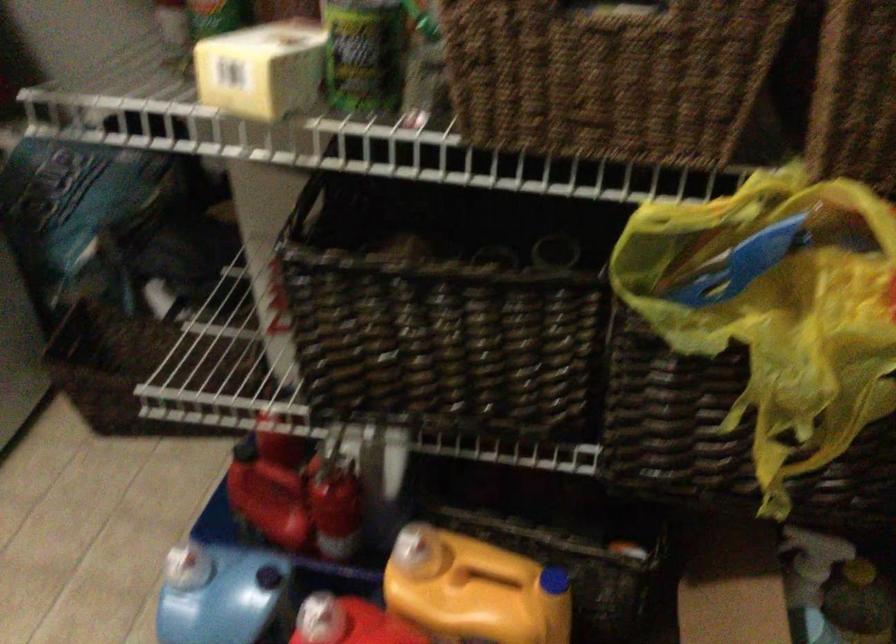
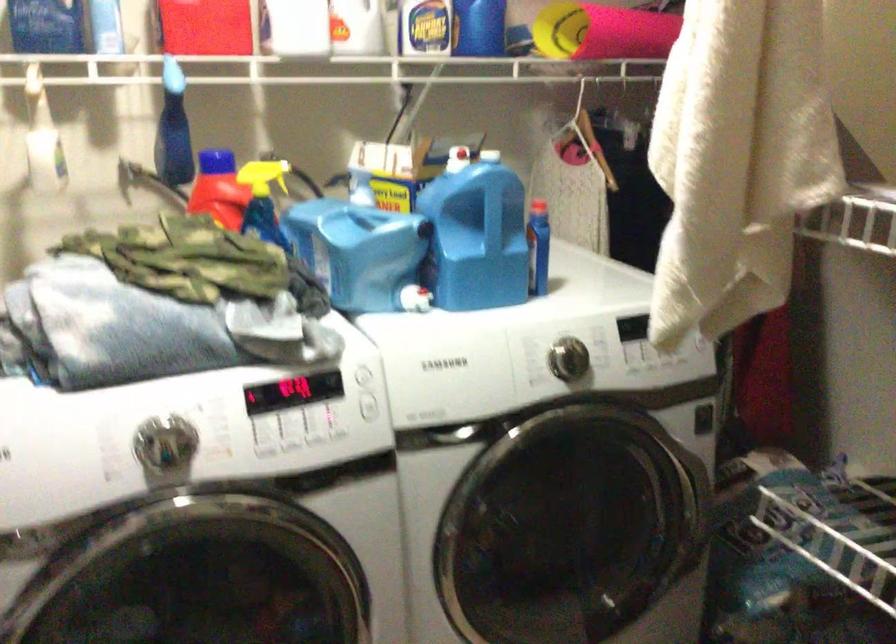
Question: The images are taken continuously from a first-person perspective. In which direction is your viewpoint rotating?

Choices:
 (A) Left
 (B) Right
 (C) Up
 (D) Down

Answer: (A)